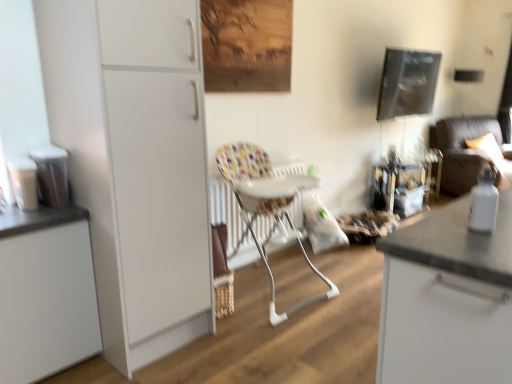
I want to click on white matte cabinet at left, arranged as the 2th cabinetry when viewed from the left, so click(135, 163).

The width and height of the screenshot is (512, 384). What do you see at coordinates (51, 174) in the screenshot? I see `satin silver trash can at left, which ranks as the 1th appliance in right-to-left order` at bounding box center [51, 174].

You are a GUI agent. You are given a task and a screenshot of the screen. Output one action in this format:
    pyautogui.click(x=<x>, y=<y>)
    Task: Click on the metallic reflective picture frame at upper right
    Image resolution: width=512 pixels, height=384 pixels.
    Given the screenshot: What is the action you would take?
    pyautogui.click(x=407, y=83)

Consider the image. What is the approximate height of white glossy bottle at right?

7.27 inches.

What do you see at coordinates (23, 182) in the screenshot? The width and height of the screenshot is (512, 384). I see `matte plastic containers at left, arranged as the 2th appliance when viewed from the right` at bounding box center [23, 182].

The image size is (512, 384). Describe the element at coordinates (266, 206) in the screenshot. I see `printed fabric highchair at center` at that location.

This screenshot has width=512, height=384. I want to click on white matte cabinet at left, arranged as the 2th cabinetry when viewed from the left, so click(135, 163).

Can you confirm if matte plastic containers at left, arranged as the 2th appliance when viewed from the right, is thinner than metallic reflective picture frame at upper right?

Yes, matte plastic containers at left, arranged as the 2th appliance when viewed from the right, is thinner than metallic reflective picture frame at upper right.

From a real-world perspective, relative to metallic reflective picture frame at upper right, is matte plastic containers at left, arranged as the 2th appliance when viewed from the right, vertically above or below?

From a real-world perspective, matte plastic containers at left, arranged as the 2th appliance when viewed from the right, is physically below metallic reflective picture frame at upper right.

Is matte plastic containers at left, arranged as the 1th appliance when viewed from the left, oriented towards metallic reflective picture frame at upper right?

No, matte plastic containers at left, arranged as the 1th appliance when viewed from the left, is not facing towards metallic reflective picture frame at upper right.

Based on the photo, how different are the orientations of matte plastic containers at left, arranged as the 2th appliance when viewed from the right, and metallic reflective picture frame at upper right in degrees?

The facing directions of matte plastic containers at left, arranged as the 2th appliance when viewed from the right, and metallic reflective picture frame at upper right are 0.0003 degrees apart.

From a real-world perspective, is metallic reflective picture frame at upper right located beneath satin silver trash can at left, which ranks as the 1th appliance in right-to-left order?

No, from a real-world perspective, metallic reflective picture frame at upper right is not below satin silver trash can at left, which ranks as the 1th appliance in right-to-left order.

Locate an element on the screen. This screenshot has width=512, height=384. the 1st appliance in front of the metallic reflective picture frame at upper right is located at coordinates (51, 174).

Is satin silver trash can at left, the 2th appliance from the left, oriented towards white matte cabinet at left, the 1th cabinetry when ordered from right to left?

No, satin silver trash can at left, the 2th appliance from the left, is not turned towards white matte cabinet at left, the 1th cabinetry when ordered from right to left.

Is satin silver trash can at left, the 2th appliance from the left, taller or shorter than white matte cabinet at left, the 1th cabinetry when ordered from right to left?

Clearly, satin silver trash can at left, the 2th appliance from the left, is shorter compared to white matte cabinet at left, the 1th cabinetry when ordered from right to left.

Which of these two, satin silver trash can at left, the 2th appliance from the left, or white matte cabinet at left, arranged as the 2th cabinetry when viewed from the left, is bigger?

Bigger between the two is white matte cabinet at left, arranged as the 2th cabinetry when viewed from the left.

Based on the photo, what's the angular difference between wooden table at right and dark brown fabric couch at right's facing directions?

wooden table at right and dark brown fabric couch at right are facing 24.4 degrees away from each other.

Is wooden table at right thinner than dark brown fabric couch at right?

Correct, the width of wooden table at right is less than that of dark brown fabric couch at right.

Is point (428, 166) closer or farther from the camera than point (499, 143)?

Point (428, 166) is farther from the camera than point (499, 143).

Is wooden table at right next to dark brown fabric couch at right and touching it?

No, wooden table at right is not next to dark brown fabric couch at right.

Does point (423, 69) appear closer or farther from the camera than point (473, 211)?

Clearly, point (423, 69) is more distant from the camera than point (473, 211).

Considering the relative sizes of metallic reflective picture frame at upper right and white glossy bottle at right in the image provided, is metallic reflective picture frame at upper right shorter than white glossy bottle at right?

Incorrect, the height of metallic reflective picture frame at upper right does not fall short of that of white glossy bottle at right.

Would you say white glossy bottle at right is part of metallic reflective picture frame at upper right's contents?

No, white glossy bottle at right is located outside of metallic reflective picture frame at upper right.

Which object is further away from the camera taking this photo, metallic reflective picture frame at upper right or white glossy bottle at right?

metallic reflective picture frame at upper right is further away from the camera.

From a real-world perspective, is metallic reflective picture frame at upper right positioned under matte plastic containers at left, arranged as the 1th appliance when viewed from the left, based on gravity?

No, from a real-world perspective, metallic reflective picture frame at upper right is not beneath matte plastic containers at left, arranged as the 1th appliance when viewed from the left.

Considering the positions of objects metallic reflective picture frame at upper right and matte plastic containers at left, arranged as the 2th appliance when viewed from the right, in the image provided, who is more to the right, metallic reflective picture frame at upper right or matte plastic containers at left, arranged as the 2th appliance when viewed from the right,?

From the viewer's perspective, metallic reflective picture frame at upper right appears more on the right side.

Between metallic reflective picture frame at upper right and matte plastic containers at left, arranged as the 2th appliance when viewed from the right, which one has smaller width?

With smaller width is matte plastic containers at left, arranged as the 2th appliance when viewed from the right.

Is metallic reflective picture frame at upper right smaller than matte plastic containers at left, arranged as the 2th appliance when viewed from the right?

No, metallic reflective picture frame at upper right is not smaller than matte plastic containers at left, arranged as the 2th appliance when viewed from the right.

Considering the relative sizes of white matte cabinet at left, which is the first cabinetry from left to right, and matte plastic containers at left, arranged as the 1th appliance when viewed from the left, in the image provided, is white matte cabinet at left, which is the first cabinetry from left to right, bigger than matte plastic containers at left, arranged as the 1th appliance when viewed from the left,?

Correct, white matte cabinet at left, which is the first cabinetry from left to right, is larger in size than matte plastic containers at left, arranged as the 1th appliance when viewed from the left.

Could you tell me if white matte cabinet at left, which is the first cabinetry from left to right, is turned towards matte plastic containers at left, arranged as the 2th appliance when viewed from the right?

No.

Is white matte cabinet at left, which is the first cabinetry from left to right, taller or shorter than matte plastic containers at left, arranged as the 2th appliance when viewed from the right?

Clearly, white matte cabinet at left, which is the first cabinetry from left to right, is taller compared to matte plastic containers at left, arranged as the 2th appliance when viewed from the right.

Image resolution: width=512 pixels, height=384 pixels. In order to click on picture frame behind the matte plastic containers at left, arranged as the 2th appliance when viewed from the right in this screenshot , I will do `click(407, 83)`.

The image size is (512, 384). Find the location of `picture frame that is on the right side of satin silver trash can at left, the 2th appliance from the left`. picture frame that is on the right side of satin silver trash can at left, the 2th appliance from the left is located at coordinates (407, 83).

From the image, which object appears to be nearer to matte plastic containers at left, arranged as the 1th appliance when viewed from the left, satin silver trash can at left, the 2th appliance from the left, or metallic reflective picture frame at upper right?

satin silver trash can at left, the 2th appliance from the left, is positioned closer to the anchor matte plastic containers at left, arranged as the 1th appliance when viewed from the left.

Which object lies further to the anchor point satin silver trash can at left, which ranks as the 1th appliance in right-to-left order, white glossy bottle at right or wooden table at right?

wooden table at right.

Estimate the real-world distances between objects in this image. Which object is further from matte plastic containers at left, arranged as the 1th appliance when viewed from the left, satin silver trash can at left, the 2th appliance from the left, or dark brown fabric couch at right?

dark brown fabric couch at right lies further to matte plastic containers at left, arranged as the 1th appliance when viewed from the left, than the other object.

From the image, which object appears to be nearer to white matte cabinet at left, which is the 2th cabinetry from right to left, satin silver trash can at left, which ranks as the 1th appliance in right-to-left order, or white glossy bottle at right?

Among the two, satin silver trash can at left, which ranks as the 1th appliance in right-to-left order, is located nearer to white matte cabinet at left, which is the 2th cabinetry from right to left.

Considering their positions, is white glossy bottle at right positioned further to printed fabric highchair at center than metallic reflective picture frame at upper right?

metallic reflective picture frame at upper right.

Which object lies nearer to the anchor point satin silver trash can at left, which ranks as the 1th appliance in right-to-left order, white matte cabinet at left, arranged as the 2th cabinetry when viewed from the left, or dark brown fabric couch at right?

Among the two, white matte cabinet at left, arranged as the 2th cabinetry when viewed from the left, is located nearer to satin silver trash can at left, which ranks as the 1th appliance in right-to-left order.

From the image, which object appears to be farther from metallic reflective picture frame at upper right, white matte cabinet at left, which is the first cabinetry from left to right, or dark brown fabric couch at right?

Among the two, white matte cabinet at left, which is the first cabinetry from left to right, is located further to metallic reflective picture frame at upper right.

When comparing their distances from dark brown fabric couch at right, does wooden table at right or matte plastic containers at left, arranged as the 2th appliance when viewed from the right, seem closer?

The object closer to dark brown fabric couch at right is wooden table at right.

Locate an element on the screen. cabinetry located between satin silver trash can at left, which ranks as the 1th appliance in right-to-left order, and printed fabric highchair at center in the left-right direction is located at coordinates (135, 163).

Where is `picture frame between satin silver trash can at left, the 2th appliance from the left, and dark brown fabric couch at right from left to right`? The image size is (512, 384). picture frame between satin silver trash can at left, the 2th appliance from the left, and dark brown fabric couch at right from left to right is located at coordinates (407, 83).

This screenshot has width=512, height=384. In order to click on appliance situated between white matte cabinet at left, which is the 2th cabinetry from right to left, and white glossy bottle at right from left to right in this screenshot , I will do `click(51, 174)`.

Where is `picture frame between matte plastic containers at left, arranged as the 1th appliance when viewed from the left, and wooden table at right`? Image resolution: width=512 pixels, height=384 pixels. picture frame between matte plastic containers at left, arranged as the 1th appliance when viewed from the left, and wooden table at right is located at coordinates (407, 83).